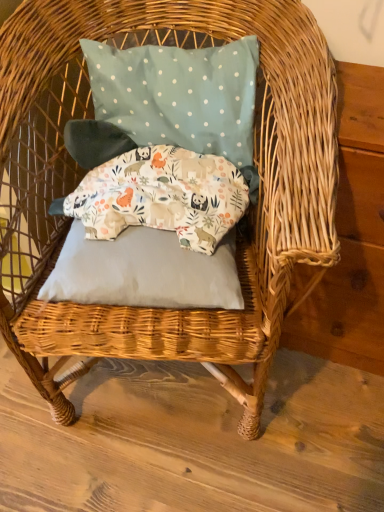
In order to click on printed fabric pillow at center, placed as the second pillow when sorted from top to bottom in this screenshot , I will do `click(160, 196)`.

I want to click on gray fabric pillow at center, arranged as the 3th pillow when viewed from the top, so click(x=144, y=271).

Locate an element on the screen. The height and width of the screenshot is (512, 384). printed fabric pillow at center, placed as the second pillow when sorted from top to bottom is located at coordinates (160, 196).

From the image's perspective, count 2nd pillows upward from the gray fabric pillow at center, arranged as the first pillow when ordered from the bottom, and point to it. Please provide its 2D coordinates.

[(180, 97)]

Is teal polka dot fabric pillow at upper center, which ranks as the 3th pillow in bottom-to-top order, at the back of gray fabric pillow at center, arranged as the first pillow when ordered from the bottom?

gray fabric pillow at center, arranged as the first pillow when ordered from the bottom, does not have its back to teal polka dot fabric pillow at upper center, which ranks as the 3th pillow in bottom-to-top order.

Considering their positions, is gray fabric pillow at center, arranged as the first pillow when ordered from the bottom, located in front of or behind teal polka dot fabric pillow at upper center, the 1th pillow when ordered from top to bottom?

Visually, gray fabric pillow at center, arranged as the first pillow when ordered from the bottom, is located in front of teal polka dot fabric pillow at upper center, the 1th pillow when ordered from top to bottom.

Is teal polka dot fabric pillow at upper center, which ranks as the 3th pillow in bottom-to-top order, turned away from printed fabric pillow at center, the second pillow positioned from the bottom?

No, teal polka dot fabric pillow at upper center, which ranks as the 3th pillow in bottom-to-top order, is not facing away from printed fabric pillow at center, the second pillow positioned from the bottom.

Looking at this image, from a real-world perspective, relative to printed fabric pillow at center, the second pillow positioned from the bottom, is teal polka dot fabric pillow at upper center, which ranks as the 3th pillow in bottom-to-top order, vertically above or below?

Clearly, from a real-world perspective, teal polka dot fabric pillow at upper center, which ranks as the 3th pillow in bottom-to-top order, is above printed fabric pillow at center, the second pillow positioned from the bottom.

Relative to printed fabric pillow at center, the second pillow positioned from the bottom, is teal polka dot fabric pillow at upper center, which ranks as the 3th pillow in bottom-to-top order, in front or behind?

teal polka dot fabric pillow at upper center, which ranks as the 3th pillow in bottom-to-top order, is positioned farther from the viewer than printed fabric pillow at center, the second pillow positioned from the bottom.

Between teal polka dot fabric pillow at upper center, the 1th pillow when ordered from top to bottom, and printed fabric pillow at center, the second pillow positioned from the bottom, which one has more height?

teal polka dot fabric pillow at upper center, the 1th pillow when ordered from top to bottom.

Is teal polka dot fabric pillow at upper center, which ranks as the 3th pillow in bottom-to-top order, positioned beyond the bounds of gray fabric pillow at center, arranged as the 3th pillow when viewed from the top?

Yes, teal polka dot fabric pillow at upper center, which ranks as the 3th pillow in bottom-to-top order, is outside of gray fabric pillow at center, arranged as the 3th pillow when viewed from the top.

Is teal polka dot fabric pillow at upper center, the 1th pillow when ordered from top to bottom, looking in the opposite direction of gray fabric pillow at center, arranged as the 3th pillow when viewed from the top?

teal polka dot fabric pillow at upper center, the 1th pillow when ordered from top to bottom, does not have its back to gray fabric pillow at center, arranged as the 3th pillow when viewed from the top.

From a real-world perspective, between teal polka dot fabric pillow at upper center, which ranks as the 3th pillow in bottom-to-top order, and gray fabric pillow at center, arranged as the first pillow when ordered from the bottom, who is vertically higher?

teal polka dot fabric pillow at upper center, which ranks as the 3th pillow in bottom-to-top order, is physically above.

What's the angular difference between printed fabric pillow at center, the second pillow positioned from the bottom, and gray fabric pillow at center, arranged as the 3th pillow when viewed from the top,'s facing directions?

3.79 degrees separate the facing orientations of printed fabric pillow at center, the second pillow positioned from the bottom, and gray fabric pillow at center, arranged as the 3th pillow when viewed from the top.

There is a gray fabric pillow at center, arranged as the first pillow when ordered from the bottom. At what (x,y) coordinates should I click in order to perform the action: click on the 1st pillow above it (from a real-world perspective). Please return your answer as a coordinate pair (x, y). The width and height of the screenshot is (384, 512). Looking at the image, I should click on (160, 196).

From the image's perspective, which is below, printed fabric pillow at center, the second pillow positioned from the bottom, or gray fabric pillow at center, arranged as the 3th pillow when viewed from the top?

gray fabric pillow at center, arranged as the 3th pillow when viewed from the top, from the image's perspective.

Between printed fabric pillow at center, the second pillow positioned from the bottom, and teal polka dot fabric pillow at upper center, which ranks as the 3th pillow in bottom-to-top order, which one is positioned in front?

Positioned in front is printed fabric pillow at center, the second pillow positioned from the bottom.

Based on the photo, is printed fabric pillow at center, the second pillow positioned from the bottom, taller or shorter than teal polka dot fabric pillow at upper center, the 1th pillow when ordered from top to bottom?

Clearly, printed fabric pillow at center, the second pillow positioned from the bottom, is shorter compared to teal polka dot fabric pillow at upper center, the 1th pillow when ordered from top to bottom.

Choose the correct answer: Is printed fabric pillow at center, the second pillow positioned from the bottom, inside teal polka dot fabric pillow at upper center, the 1th pillow when ordered from top to bottom, or outside it?

The correct answer is: outside.

Based on the photo, from a real-world perspective, which object stands above the other?

teal polka dot fabric pillow at upper center, which ranks as the 3th pillow in bottom-to-top order, is physically above.

Measure the distance from gray fabric pillow at center, arranged as the 3th pillow when viewed from the top, to printed fabric pillow at center, placed as the second pillow when sorted from top to bottom.

→ The distance of gray fabric pillow at center, arranged as the 3th pillow when viewed from the top, from printed fabric pillow at center, placed as the second pillow when sorted from top to bottom, is 3.08 inches.

How many degrees apart are the facing directions of gray fabric pillow at center, arranged as the first pillow when ordered from the bottom, and printed fabric pillow at center, placed as the second pillow when sorted from top to bottom?

The angle between the facing direction of gray fabric pillow at center, arranged as the first pillow when ordered from the bottom, and the facing direction of printed fabric pillow at center, placed as the second pillow when sorted from top to bottom, is 3.79 degrees.

Considering the points (70, 278) and (146, 223), which point is in front, point (70, 278) or point (146, 223)?

Positioned in front is point (70, 278).

From the picture: Can you confirm if gray fabric pillow at center, arranged as the first pillow when ordered from the bottom, is smaller than printed fabric pillow at center, placed as the second pillow when sorted from top to bottom?

Yes.

From a real-world perspective, count 2nd pillows upward from the gray fabric pillow at center, arranged as the 3th pillow when viewed from the top, and point to it. Please provide its 2D coordinates.

[(180, 97)]

Find the location of a particular element. Image resolution: width=384 pixels, height=512 pixels. pillow lying on the right of printed fabric pillow at center, the second pillow positioned from the bottom is located at coordinates (180, 97).

When comparing their distances from teal polka dot fabric pillow at upper center, the 1th pillow when ordered from top to bottom, does gray fabric pillow at center, arranged as the first pillow when ordered from the bottom, or printed fabric pillow at center, the second pillow positioned from the bottom, seem closer?

printed fabric pillow at center, the second pillow positioned from the bottom, lies closer to teal polka dot fabric pillow at upper center, the 1th pillow when ordered from top to bottom, than the other object.

When comparing their distances from printed fabric pillow at center, placed as the second pillow when sorted from top to bottom, does gray fabric pillow at center, arranged as the 3th pillow when viewed from the top, or teal polka dot fabric pillow at upper center, the 1th pillow when ordered from top to bottom, seem closer?

The object closer to printed fabric pillow at center, placed as the second pillow when sorted from top to bottom, is gray fabric pillow at center, arranged as the 3th pillow when viewed from the top.

Considering their positions, is teal polka dot fabric pillow at upper center, the 1th pillow when ordered from top to bottom, positioned further to printed fabric pillow at center, placed as the second pillow when sorted from top to bottom, than gray fabric pillow at center, arranged as the 3th pillow when viewed from the top?

Based on the image, teal polka dot fabric pillow at upper center, the 1th pillow when ordered from top to bottom, appears to be further to printed fabric pillow at center, placed as the second pillow when sorted from top to bottom.

Looking at the image, which one is located further to gray fabric pillow at center, arranged as the 3th pillow when viewed from the top, teal polka dot fabric pillow at upper center, the 1th pillow when ordered from top to bottom, or printed fabric pillow at center, the second pillow positioned from the bottom?

teal polka dot fabric pillow at upper center, the 1th pillow when ordered from top to bottom.

Which object lies further to the anchor point teal polka dot fabric pillow at upper center, which ranks as the 3th pillow in bottom-to-top order, printed fabric pillow at center, the second pillow positioned from the bottom, or gray fabric pillow at center, arranged as the 3th pillow when viewed from the top?

Among the two, gray fabric pillow at center, arranged as the 3th pillow when viewed from the top, is located further to teal polka dot fabric pillow at upper center, which ranks as the 3th pillow in bottom-to-top order.

Which object lies nearer to the anchor point gray fabric pillow at center, arranged as the 3th pillow when viewed from the top, printed fabric pillow at center, the second pillow positioned from the bottom, or teal polka dot fabric pillow at upper center, the 1th pillow when ordered from top to bottom?

The object closer to gray fabric pillow at center, arranged as the 3th pillow when viewed from the top, is printed fabric pillow at center, the second pillow positioned from the bottom.

Find the location of a particular element. The image size is (384, 512). pillow between teal polka dot fabric pillow at upper center, which ranks as the 3th pillow in bottom-to-top order, and gray fabric pillow at center, arranged as the 3th pillow when viewed from the top, in the vertical direction is located at coordinates (160, 196).